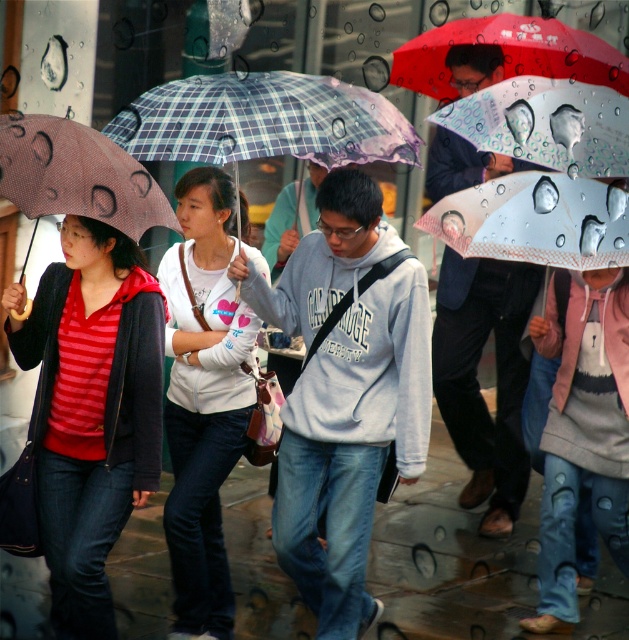
Question: Based on their relative distances, which object is farther from the red matte umbrella at upper center?

Choices:
 (A) matte black jacket at center
 (B) matte brown umbrella at left

Answer: (B)

Question: Is glossy concrete pavement at lower center to the right of white glossy umbrella at center from the viewer's perspective?

Choices:
 (A) yes
 (B) no

Answer: (B)

Question: Is plaid fabric umbrella at center smaller than white glossy umbrella at center?

Choices:
 (A) no
 (B) yes

Answer: (A)

Question: Is matte black jacket at center wider than white glossy umbrella at upper center?

Choices:
 (A) no
 (B) yes

Answer: (A)

Question: Which of the following is the farthest from the observer?

Choices:
 (A) (155, 515)
 (B) (569, 592)
 (C) (291, 289)
 (D) (503, 154)

Answer: (A)

Question: Among these points, which one is farthest from the camera?

Choices:
 (A) (306, 100)
 (B) (411, 513)

Answer: (B)